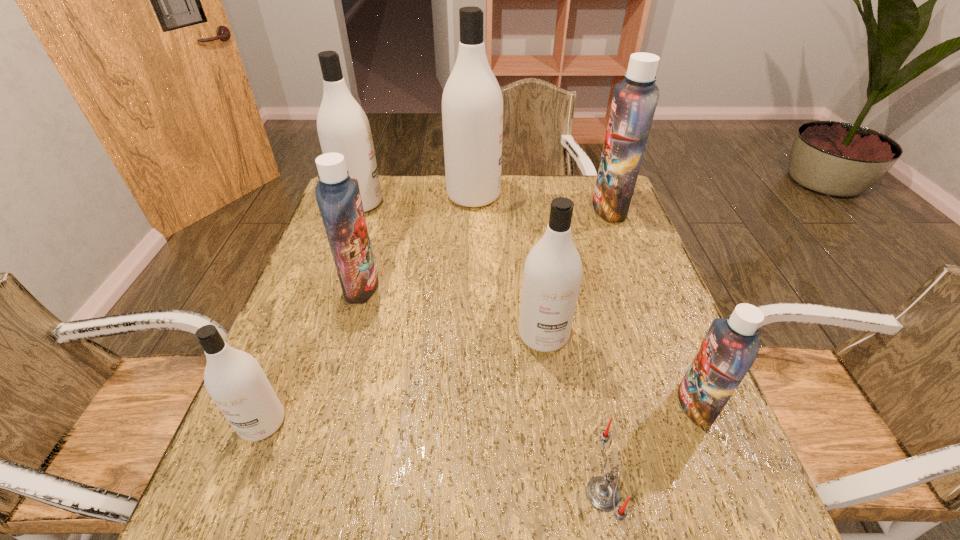
Where is `the shortest object`? the shortest object is located at coordinates (602, 492).

The width and height of the screenshot is (960, 540). In order to click on candle in this screenshot , I will do `click(602, 492)`.

At what (x,y) coordinates should I click in order to perform the action: click on free space located on the front-facing side of the fifth object from right to left. Please return your answer as a coordinate pair (x, y). Looking at the image, I should click on (562, 195).

Find the location of a particular element. The height and width of the screenshot is (540, 960). vacant space located 0.240m on the front-facing side of the second biggest white shampoo is located at coordinates (458, 203).

Where is `vacant space located 0.360m on the front label of the biggest blue shampoo`? vacant space located 0.360m on the front label of the biggest blue shampoo is located at coordinates (479, 208).

At what (x,y) coordinates should I click in order to perform the action: click on blank space located on the front label of the biggest blue shampoo. Please return your answer as a coordinate pair (x, y). The image size is (960, 540). Looking at the image, I should click on (536, 208).

Identify the location of free spot located on the front label of the biggest blue shampoo. The image size is (960, 540). (504, 208).

Locate an element on the screen. vacant area located 0.390m on the front label of the leftmost blue shampoo is located at coordinates coord(530,286).

Identify the location of free region located 0.360m on the front-facing side of the rightmost white shampoo. The width and height of the screenshot is (960, 540). (570, 537).

Where is `vacant region located on the front label of the smallest blue shampoo`? vacant region located on the front label of the smallest blue shampoo is located at coordinates (614, 404).